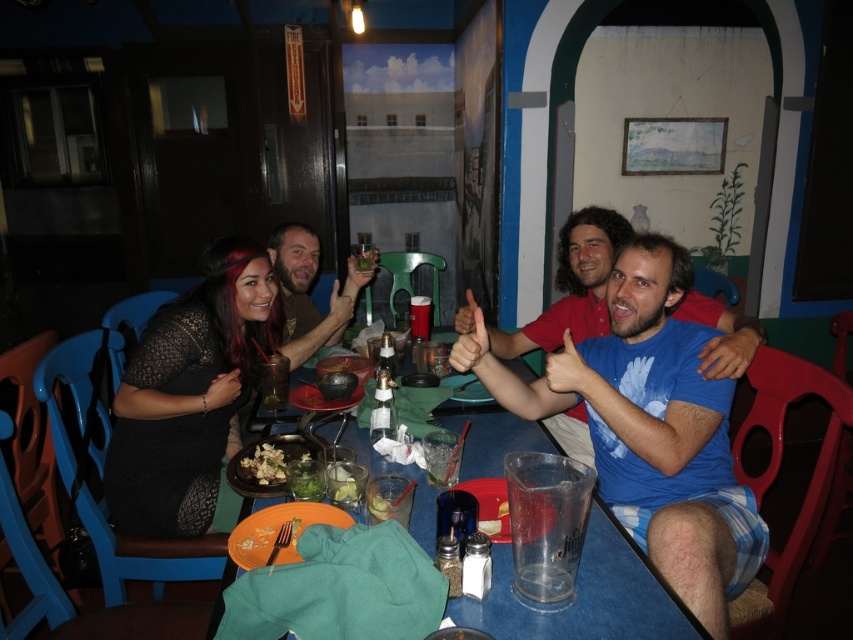
Does white crumbly food at center have a lesser height compared to matte plastic cup at center?

Indeed, white crumbly food at center has a lesser height compared to matte plastic cup at center.

Find the location of a particular element. The width and height of the screenshot is (853, 640). white crumbly food at center is located at coordinates (264, 465).

Find the location of a particular element. white crumbly food at center is located at coordinates (264, 465).

Looking at this image, can you confirm if blue plastic table at center is positioned to the left of green leafy salad at center?

In fact, blue plastic table at center is to the right of green leafy salad at center.

Does blue plastic table at center have a greater height compared to green leafy salad at center?

Correct, blue plastic table at center is much taller as green leafy salad at center.

Who is more forward, (608, 554) or (335, 493)?

Positioned in front is point (608, 554).

Find the location of a particular element. This screenshot has width=853, height=640. blue plastic table at center is located at coordinates (587, 596).

Can you confirm if matte brown hair at center is shorter than white crumbly food at center?

In fact, matte brown hair at center may be taller than white crumbly food at center.

Between point (372, 266) and point (263, 476), which one is positioned in front?

Positioned in front is point (263, 476).

Find the location of a particular element. The image size is (853, 640). matte brown hair at center is located at coordinates (306, 289).